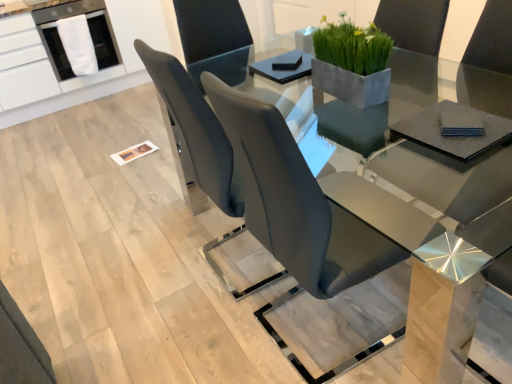
Question: Can you confirm if matte gray chair at center, which is the second chair in left-to-right order, is positioned to the left of white fabric at upper left?

Choices:
 (A) no
 (B) yes

Answer: (A)

Question: Does matte gray chair at center, positioned as the 1th chair in right-to-left order, turn towards white fabric at upper left?

Choices:
 (A) yes
 (B) no

Answer: (B)

Question: Is matte gray chair at center, positioned as the 1th chair in right-to-left order, facing away from white fabric at upper left?

Choices:
 (A) no
 (B) yes

Answer: (A)

Question: Is the position of matte gray chair at center, which is the second chair in left-to-right order, less distant than that of white fabric at upper left?

Choices:
 (A) yes
 (B) no

Answer: (A)

Question: Can you confirm if matte gray chair at center, positioned as the 1th chair in right-to-left order, is wider than white fabric at upper left?

Choices:
 (A) yes
 (B) no

Answer: (A)

Question: In terms of height, does matte gray chair at center, which is the second chair in left-to-right order, look taller or shorter compared to green matte concrete planter at upper center?

Choices:
 (A) tall
 (B) short

Answer: (A)

Question: From the image's perspective, is matte gray chair at center, positioned as the 1th chair in right-to-left order, positioned above or below green matte concrete planter at upper center?

Choices:
 (A) above
 (B) below

Answer: (B)

Question: From a real-world perspective, relative to green matte concrete planter at upper center, is matte gray chair at center, which is the second chair in left-to-right order, vertically above or below?

Choices:
 (A) below
 (B) above

Answer: (A)

Question: Considering the positions of point (282, 130) and point (347, 49), is point (282, 130) closer or farther from the camera than point (347, 49)?

Choices:
 (A) closer
 (B) farther

Answer: (A)

Question: In the image, is green matte concrete planter at upper center on the left side or the right side of white glossy dishwasher at upper left?

Choices:
 (A) left
 (B) right

Answer: (B)

Question: From a real-world perspective, is green matte concrete planter at upper center physically located above or below white glossy dishwasher at upper left?

Choices:
 (A) below
 (B) above

Answer: (B)

Question: Looking at their shapes, would you say green matte concrete planter at upper center is wider or thinner than white glossy dishwasher at upper left?

Choices:
 (A) wide
 (B) thin

Answer: (B)

Question: Relative to white glossy dishwasher at upper left, is green matte concrete planter at upper center in front or behind?

Choices:
 (A) front
 (B) behind

Answer: (A)

Question: From the image's perspective, is matte gray chair at center, positioned as the 1th chair in right-to-left order, positioned above or below white glossy dishwasher at upper left?

Choices:
 (A) below
 (B) above

Answer: (A)

Question: Is matte gray chair at center, which is the second chair in left-to-right order, taller or shorter than white glossy dishwasher at upper left?

Choices:
 (A) tall
 (B) short

Answer: (A)